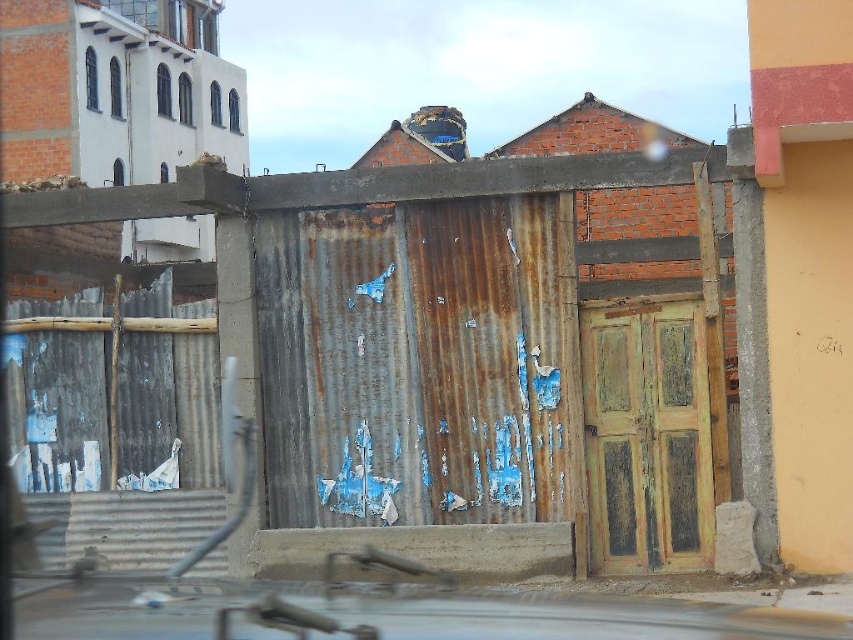
Question: Is metallic car at lower center above rusty wooden door at center?

Choices:
 (A) no
 (B) yes

Answer: (B)

Question: Can you confirm if metallic car at lower center is positioned to the left of rusty wooden door at center?

Choices:
 (A) no
 (B) yes

Answer: (B)

Question: Which point is farther from the camera taking this photo?

Choices:
 (A) (693, 620)
 (B) (611, 416)

Answer: (B)

Question: Does metallic car at lower center appear over rusty wooden door at center?

Choices:
 (A) no
 (B) yes

Answer: (B)